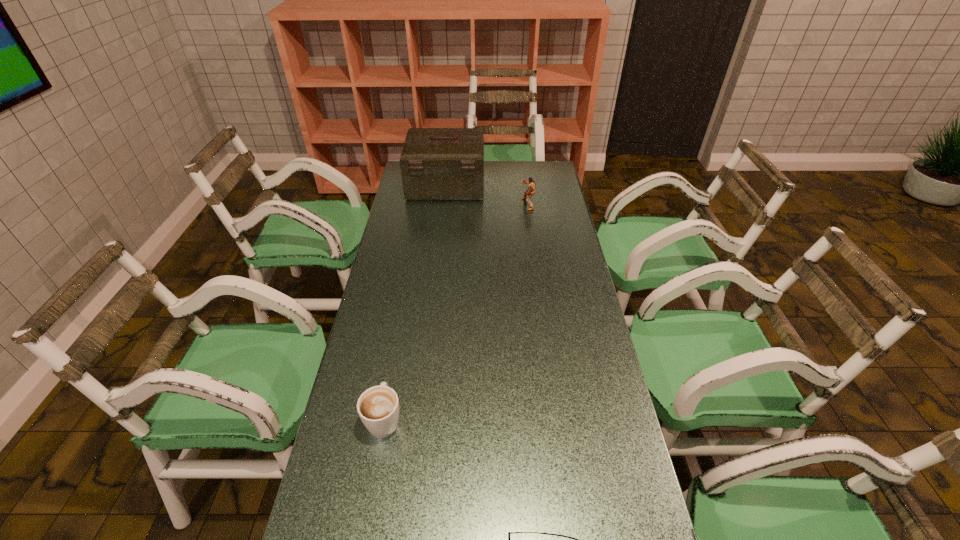
Image resolution: width=960 pixels, height=540 pixels. I want to click on vacant position located with the handle on the side of the second nearest object, so click(x=391, y=382).

The width and height of the screenshot is (960, 540). I want to click on object at the far edge, so click(436, 163).

In order to click on the first-aid kit that is at the left edge in this screenshot , I will do `click(436, 163)`.

Find the location of a particular element. cappuccino located at the left edge is located at coordinates (378, 407).

The image size is (960, 540). I want to click on object at the right edge, so click(x=528, y=194).

This screenshot has width=960, height=540. In order to click on object located at the far left corner in this screenshot , I will do `click(436, 163)`.

The width and height of the screenshot is (960, 540). Find the location of `free space at the left edge`. free space at the left edge is located at coordinates (418, 213).

This screenshot has width=960, height=540. Identify the location of free location at the right edge of the desktop. (593, 366).

Image resolution: width=960 pixels, height=540 pixels. I want to click on free space at the far right corner of the desktop, so click(545, 178).

Image resolution: width=960 pixels, height=540 pixels. I want to click on free space between the puncher and the third tallest object, so click(x=456, y=312).